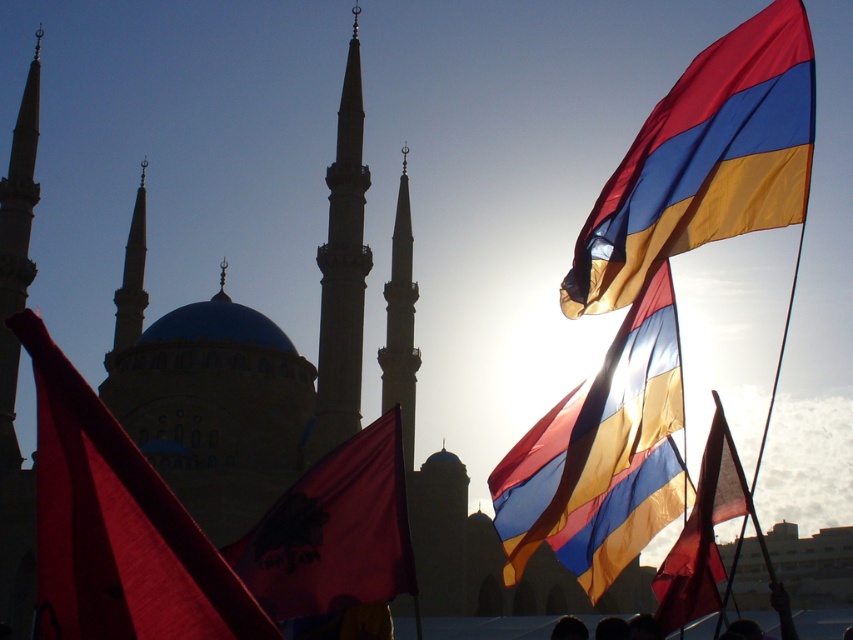
Does matte blue and gold flag at upper right appear on the left side of matte red flag at center?

Correct, you'll find matte blue and gold flag at upper right to the left of matte red flag at center.

Identify the location of matte blue and gold flag at upper right. (705, 161).

Is matte blue and gold flag at upper right shorter than silky blue and yellow flag at upper right?

Yes.

Which is more to the right, matte blue and gold flag at upper right or silky blue and yellow flag at upper right?

matte blue and gold flag at upper right is more to the right.

Which is behind, point (743, 128) or point (543, 432)?

The point (543, 432) is behind.

The width and height of the screenshot is (853, 640). In order to click on matte blue and gold flag at upper right in this screenshot , I will do click(x=705, y=161).

Between point (349, 602) and point (717, 410), which one is positioned in front?

Point (349, 602) is more forward.

Between dark red fabric flag at center and matte red flag at center, which one appears on the left side from the viewer's perspective?

From the viewer's perspective, dark red fabric flag at center appears more on the left side.

Who is more forward, (270, 531) or (691, 579)?

Point (270, 531) is more forward.

Locate an element on the screen. dark red fabric flag at center is located at coordinates (334, 532).